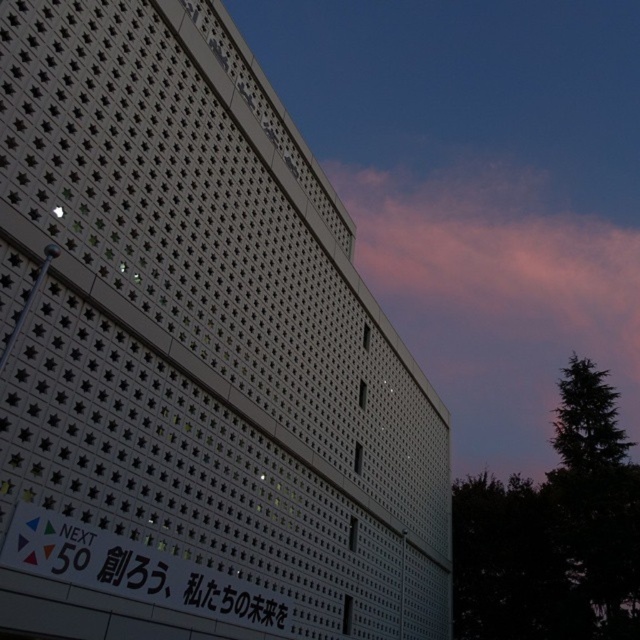
You are an architect designing a new building and want to ensure the pink cotton cloud at upper center and the white glossy sign at lower left are visible from the main entrance. Based on their positions, which object will appear closer to the entrance when viewed from the front?

The white glossy sign at lower left will appear closer to the entrance because it is positioned to the left of the pink cotton cloud at upper center, which is further to the right.

You are an architect evaluating the building design. You notice the pink cotton cloud at upper center and the white glossy sign at lower left. Which object would cast a larger shadow if the sun is setting behind the building?

The pink cotton cloud at upper center would cast a larger shadow because it is larger in size than the white glossy sign at lower left.